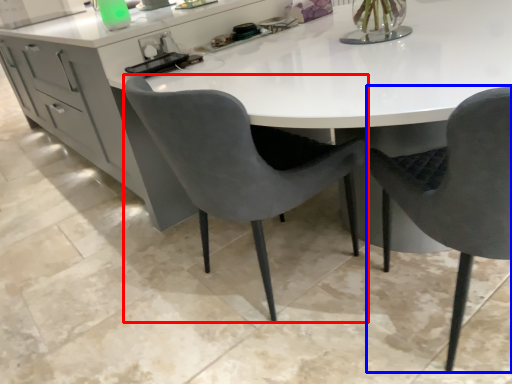
Question: Among these objects, which one is farthest to the camera, chair (highlighted by a red box) or chair (highlighted by a blue box)?

Choices:
 (A) chair
 (B) chair

Answer: (A)